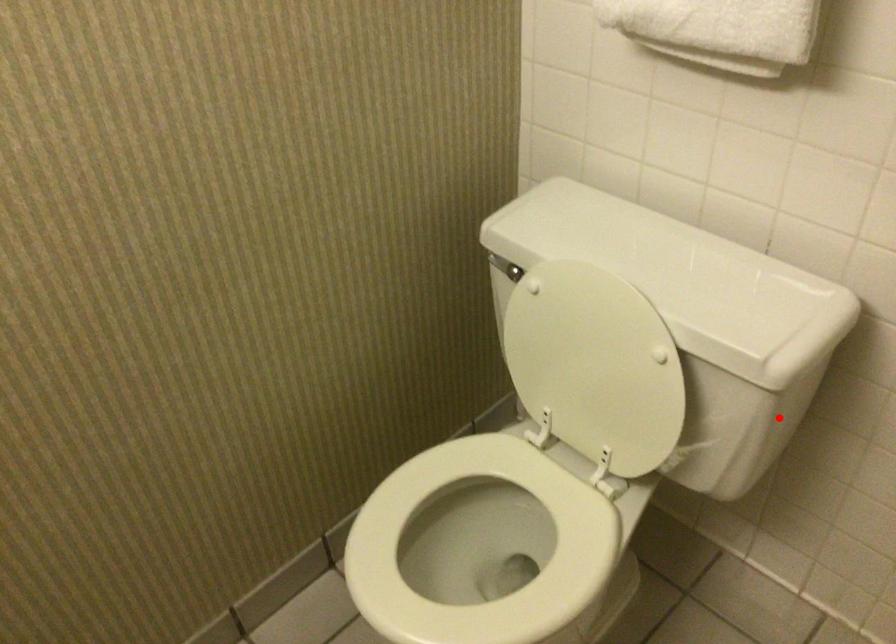
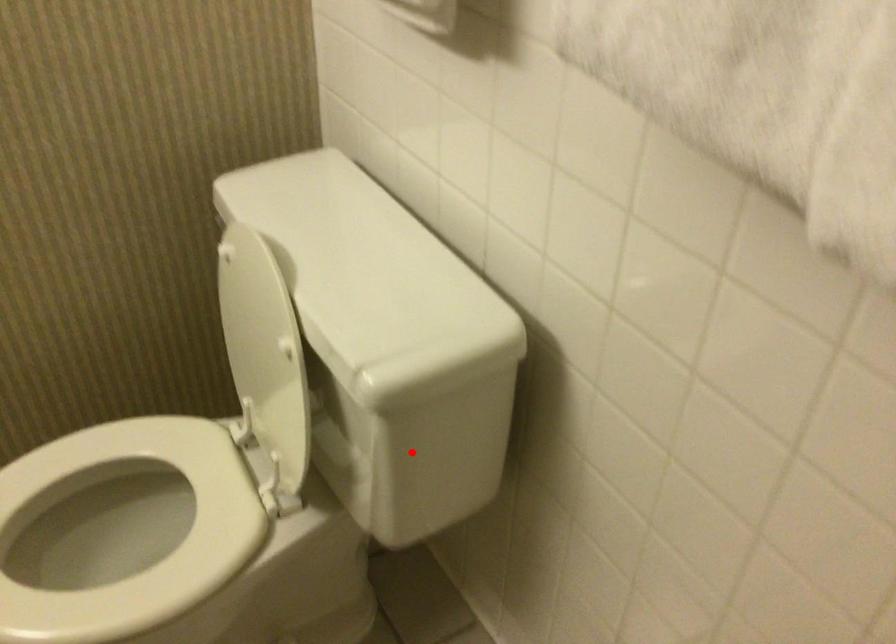
I am providing you with two images of the same scene from different viewpoints. A red point is marked on the first image and another point is marked on the second image. Are the points marked in image1 and image2 representing the same 3D position?

Yes